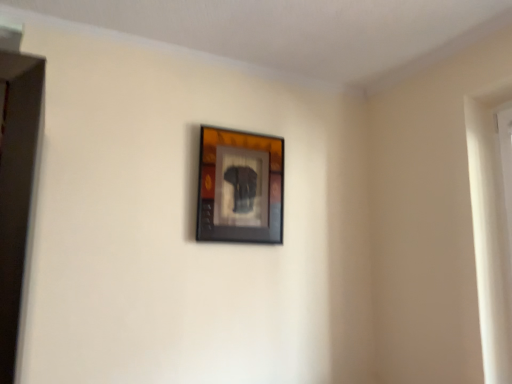
You are a GUI agent. You are given a task and a screenshot of the screen. Output one action in this format:
    pyautogui.click(x=<x>, y=<y>)
    Task: Click on the wooden-framed artwork at center
    The width and height of the screenshot is (512, 384).
    Given the screenshot: What is the action you would take?
    pyautogui.click(x=240, y=187)

Describe the element at coordinates (240, 187) in the screenshot. Image resolution: width=512 pixels, height=384 pixels. I see `wooden-framed artwork at center` at that location.

Where is `wooden-framed artwork at center`? Image resolution: width=512 pixels, height=384 pixels. wooden-framed artwork at center is located at coordinates (240, 187).